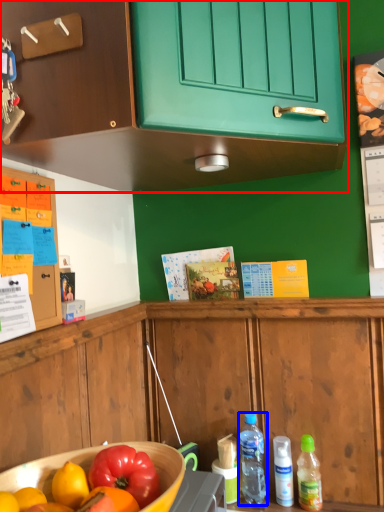
Question: Which object appears closest to the camera in this image, cabinetry (highlighted by a red box) or bottle (highlighted by a blue box)?

Choices:
 (A) cabinetry
 (B) bottle

Answer: (A)